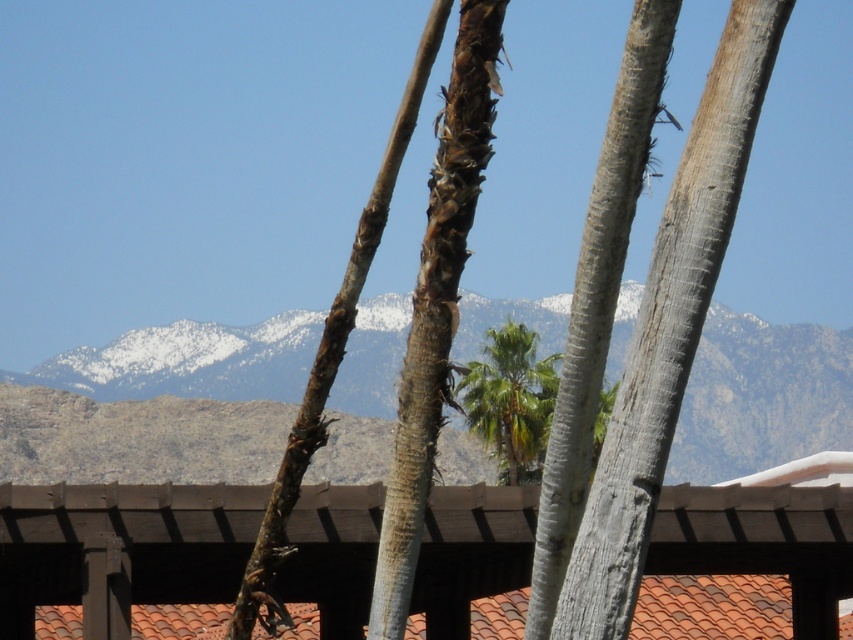
Question: Which point is farther to the camera?

Choices:
 (A) green leafy palm tree at center
 (B) brown wood pergola at center

Answer: (A)

Question: Estimate the real-world distances between objects in this image. Which object is farther from the snowy rock mountain range at center?

Choices:
 (A) green leafy palm tree at center
 (B) brown wood pergola at center

Answer: (B)

Question: Does brown wood pergola at center have a smaller size compared to snowy rock mountain range at center?

Choices:
 (A) no
 (B) yes

Answer: (B)

Question: Can you confirm if brown wood pergola at center is positioned to the right of snowy rock mountain range at center?

Choices:
 (A) yes
 (B) no

Answer: (A)

Question: Which point appears farthest from the camera in this image?

Choices:
 (A) (537, 372)
 (B) (824, 330)
 (C) (82, 493)

Answer: (B)

Question: Is brown wood pergola at center closer to camera compared to snowy rock mountain range at center?

Choices:
 (A) yes
 (B) no

Answer: (B)